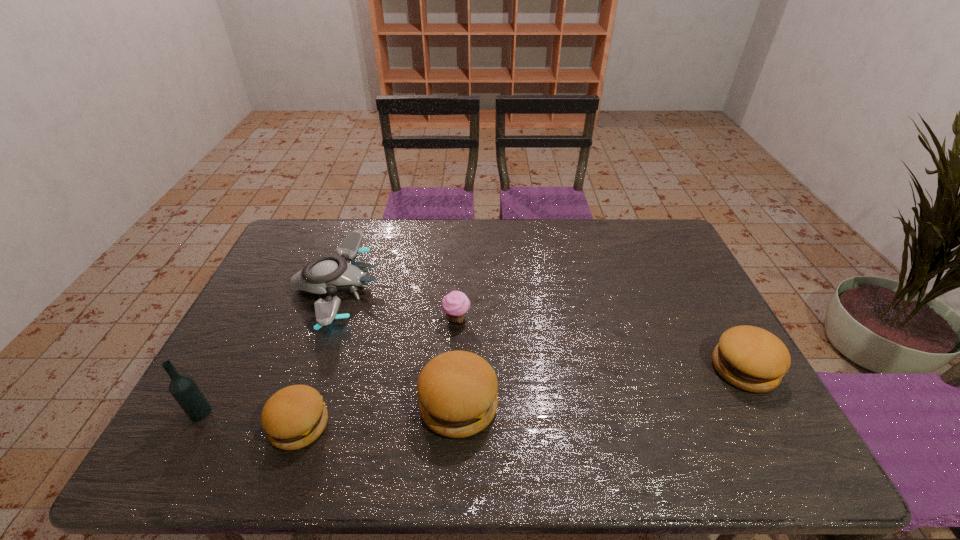
Locate an element on the screen. The width and height of the screenshot is (960, 540). object that is at the near left corner is located at coordinates (183, 388).

The width and height of the screenshot is (960, 540). I want to click on object located at the near right corner, so click(x=750, y=358).

Where is `vacant space at the far edge of the desktop`? This screenshot has width=960, height=540. vacant space at the far edge of the desktop is located at coordinates (369, 229).

Where is `vacant space at the near edge of the desktop`? vacant space at the near edge of the desktop is located at coordinates (590, 394).

In the image, there is a desktop. Identify the location of vacant space at the left edge. Image resolution: width=960 pixels, height=540 pixels. (265, 300).

I want to click on vacant space at the right edge of the desktop, so click(712, 340).

The width and height of the screenshot is (960, 540). I want to click on free space at the far left corner of the desktop, so click(x=324, y=248).

Identify the location of vacant space at the near left corner. (235, 398).

This screenshot has width=960, height=540. Identify the location of vacant region at the far right corner of the desktop. (659, 223).

I want to click on free space at the near right corner of the desktop, so click(723, 402).